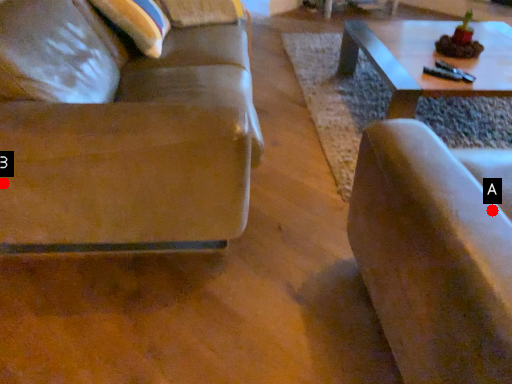
Question: Two points are circled on the image, labeled by A and B beside each circle. Which of the following is the closest to the observer?

Choices:
 (A) A is closer
 (B) B is closer

Answer: (A)